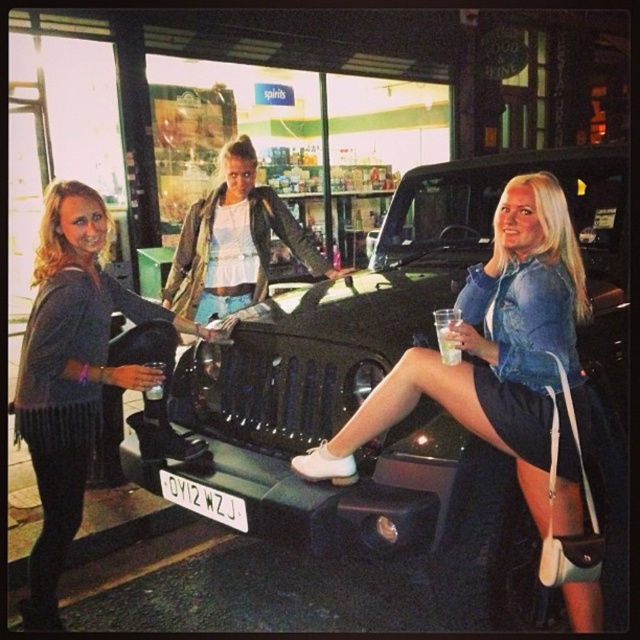
Question: Can you confirm if black matte car at center is positioned to the left of white plastic license plate at center?

Choices:
 (A) no
 (B) yes

Answer: (A)

Question: Which point is farther to the camera?

Choices:
 (A) (157, 408)
 (B) (448, 339)
 (C) (240, 502)
 (D) (353, 394)

Answer: (A)

Question: Which is nearer to the leather jacket at center?

Choices:
 (A) clear plastic bottle at center
 (B) matte black jacket at left

Answer: (A)

Question: Does leather jacket at center appear on the left side of clear plastic bottle at center?

Choices:
 (A) no
 (B) yes

Answer: (A)

Question: Which object appears closest to the camera in this image?

Choices:
 (A) black matte car at center
 (B) clear plastic cup at center
 (C) leather jacket at center
 (D) white plastic license plate at center

Answer: (B)

Question: Can you confirm if black matte car at center is positioned below leather jacket at center?

Choices:
 (A) no
 (B) yes

Answer: (B)